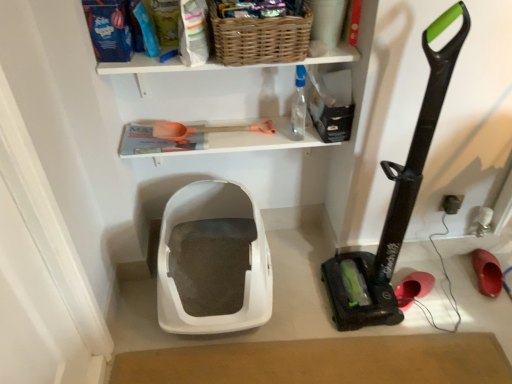
Where is `free region on the left part of black plastic vacuum cleaner at right`? Image resolution: width=512 pixels, height=384 pixels. free region on the left part of black plastic vacuum cleaner at right is located at coordinates (303, 292).